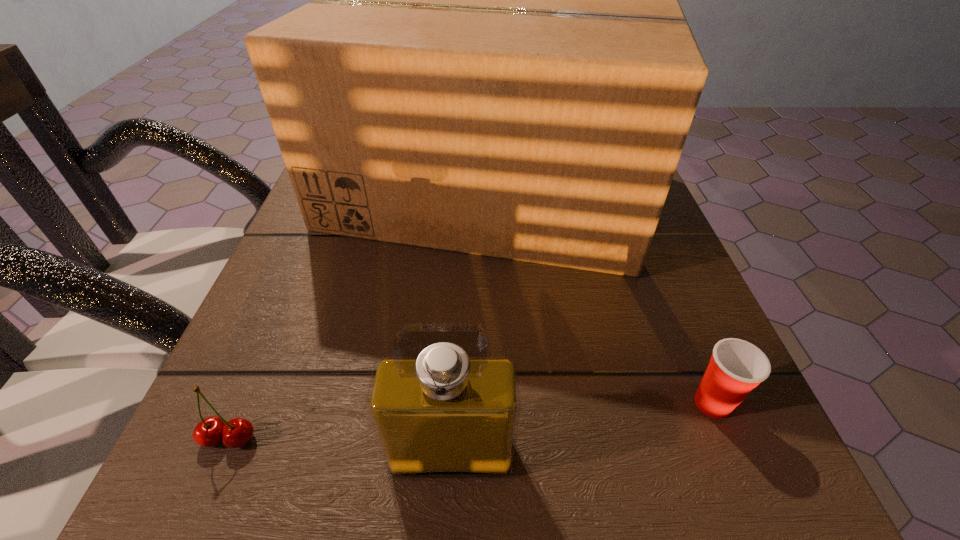
At what (x,y) coordinates should I click in order to perform the action: click on box that is positioned at the left edge. Please return your answer as a coordinate pair (x, y). The width and height of the screenshot is (960, 540). Looking at the image, I should click on pos(495,62).

This screenshot has height=540, width=960. Identify the location of cherry located in the left edge section of the desktop. click(x=209, y=432).

Locate an element on the screen. The width and height of the screenshot is (960, 540). box that is positioned at the right edge is located at coordinates (495, 62).

Locate an element on the screen. The height and width of the screenshot is (540, 960). Dixie cup at the right edge is located at coordinates (736, 367).

Locate an element on the screen. object that is at the far left corner is located at coordinates (495, 62).

Where is `object positioned at the near left corner`? The image size is (960, 540). object positioned at the near left corner is located at coordinates (209, 432).

This screenshot has width=960, height=540. I want to click on object located at the far right corner, so click(x=495, y=62).

This screenshot has width=960, height=540. Find the location of `free space at the near edge of the desktop`. free space at the near edge of the desktop is located at coordinates (462, 529).

You are a GUI agent. You are given a task and a screenshot of the screen. Output one action in this format:
    pyautogui.click(x=<x>, y=<y>)
    Task: Click on the vacant space at the left edge of the desktop
    
    Given the screenshot: What is the action you would take?
    pyautogui.click(x=319, y=431)

Find the location of `free space at the right edge of the desktop`. free space at the right edge of the desktop is located at coordinates (698, 295).